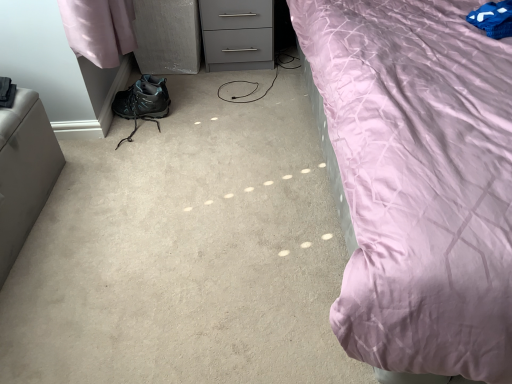
The height and width of the screenshot is (384, 512). Identify the location of free spot to the right of matte black hiking boot at lower left. (182, 104).